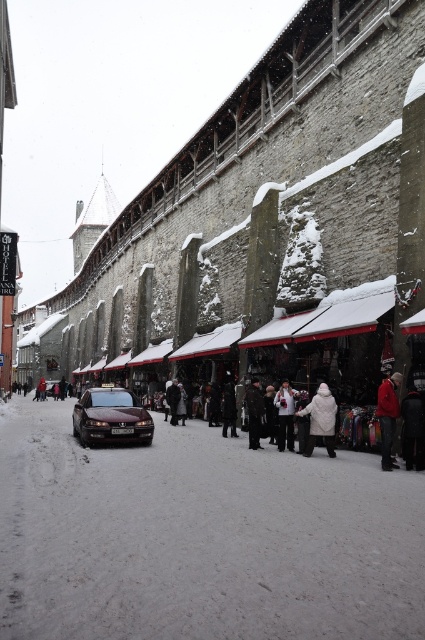
Question: Which point appears closest to the camera in this image?

Choices:
 (A) (258, 412)
 (B) (410, 426)

Answer: (B)

Question: Does dark gray jacket at center appear over dark brown fur coat at center?

Choices:
 (A) no
 (B) yes

Answer: (A)

Question: Is shiny maroon sedan at center behind white woolen hat at center?

Choices:
 (A) yes
 (B) no

Answer: (B)

Question: Where is red woolen jacket at lower right located in relation to white woolen hat at center in the image?

Choices:
 (A) below
 (B) above

Answer: (B)

Question: Considering the real-world distances, which object is farthest from the red woolen jacket at lower right?

Choices:
 (A) white matte coat at center
 (B) white woolen coat at center

Answer: (B)

Question: Considering the real-world distances, which object is closest to the white matte coat at center?

Choices:
 (A) red woolen jacket at lower right
 (B) white woolen hat at center

Answer: (B)